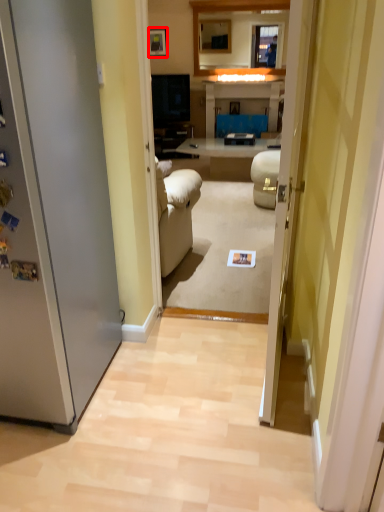
Question: From the image, what is the correct spatial relationship of picture frame (annotated by the red box) in relation to glass door?

Choices:
 (A) left
 (B) right

Answer: (A)